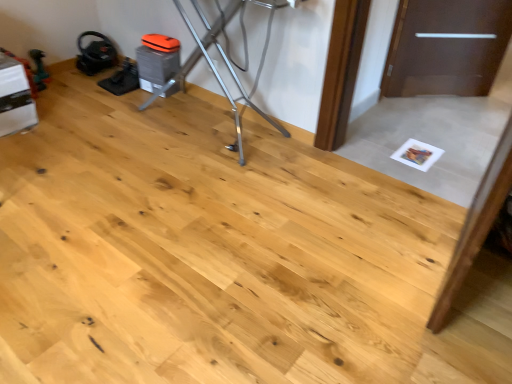
Identify the location of vacant space underneath brown matte door at upper right (from a real-world perspective). Image resolution: width=512 pixels, height=384 pixels. (433, 97).